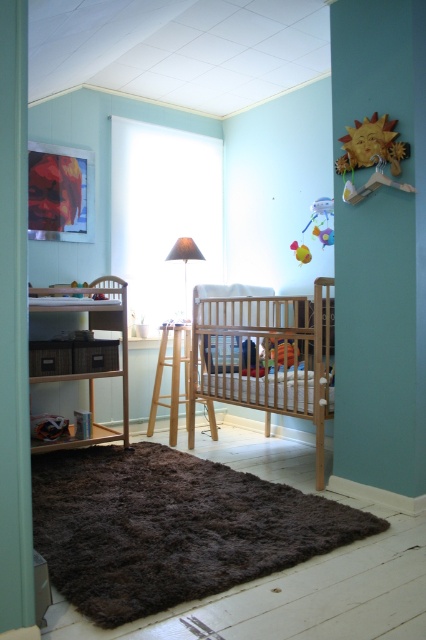
Which is behind, point (172, 323) or point (186, 241)?

Positioned behind is point (186, 241).

Can you confirm if wooden stool at center is shorter than matte gray lampshade at center?

Incorrect, wooden stool at center's height does not fall short of matte gray lampshade at center's.

The width and height of the screenshot is (426, 640). Find the location of `wooden stool at center`. wooden stool at center is located at coordinates (172, 378).

Is point (233, 305) positioned before point (397, 186)?

No, it is behind (397, 186).

Who is lower down, light brown wooden crib at center or wooden sun at upper right?

light brown wooden crib at center is lower down.

Locate an element on the screen. light brown wooden crib at center is located at coordinates (264, 356).

Who is taller, wooden sun at upper right or yellow rubber duck at center?

Standing taller between the two is wooden sun at upper right.

This screenshot has height=640, width=426. What do you see at coordinates (371, 156) in the screenshot?
I see `wooden sun at upper right` at bounding box center [371, 156].

Between point (356, 134) and point (299, 253), which one is positioned behind?

Point (299, 253)

Where is `wooden sun at upper right`? wooden sun at upper right is located at coordinates (371, 156).